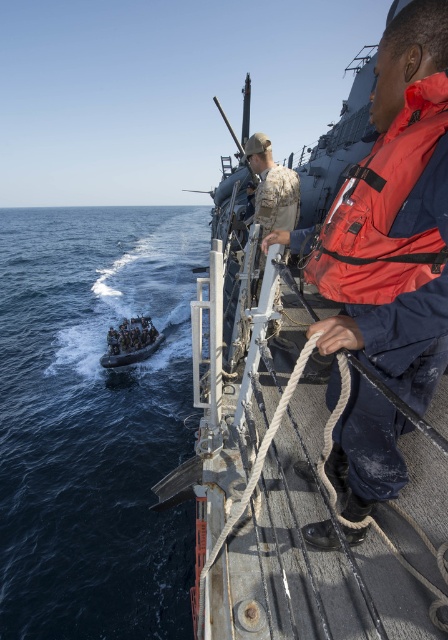
Question: Which point is closer to the camera?

Choices:
 (A) dark blue water at lower left
 (B) dark blue fabric life vest at lower center

Answer: (A)

Question: Can you confirm if dark blue water at lower left is wider than dark blue fabric life vest at lower center?

Choices:
 (A) yes
 (B) no

Answer: (A)

Question: Does dark blue water at lower left have a lesser width compared to rustic wooden boat at center?

Choices:
 (A) yes
 (B) no

Answer: (B)

Question: Which point is closer to the camera taking this photo?

Choices:
 (A) (34, 490)
 (B) (154, 339)
 (C) (430, 244)

Answer: (C)

Question: Which object appears closest to the camera in this image?

Choices:
 (A) dark blue fabric life vest at lower center
 (B) rustic wooden boat at center
 (C) dark blue water at lower left

Answer: (B)

Question: Is rustic wooden boat at center to the right of red matte life jacket at upper right from the viewer's perspective?

Choices:
 (A) yes
 (B) no

Answer: (B)